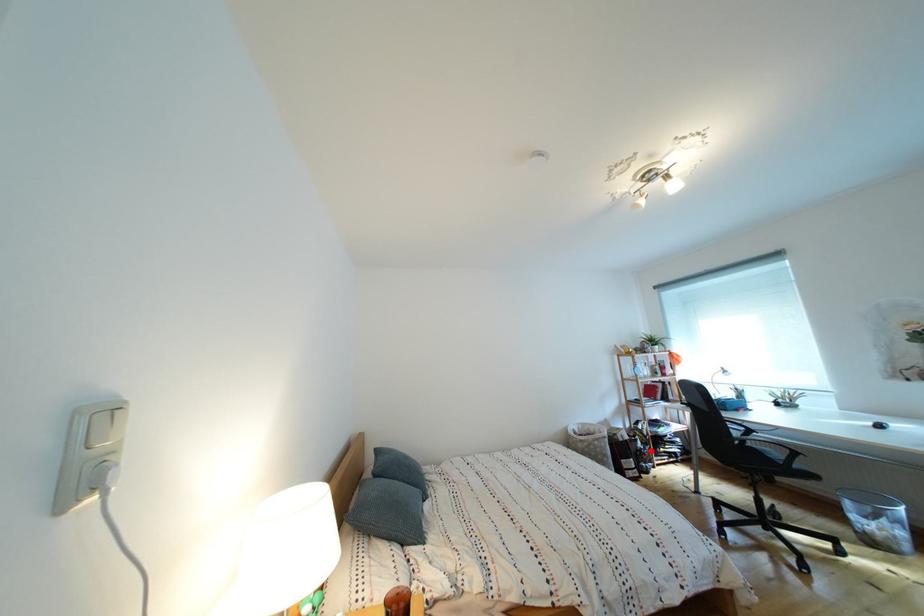
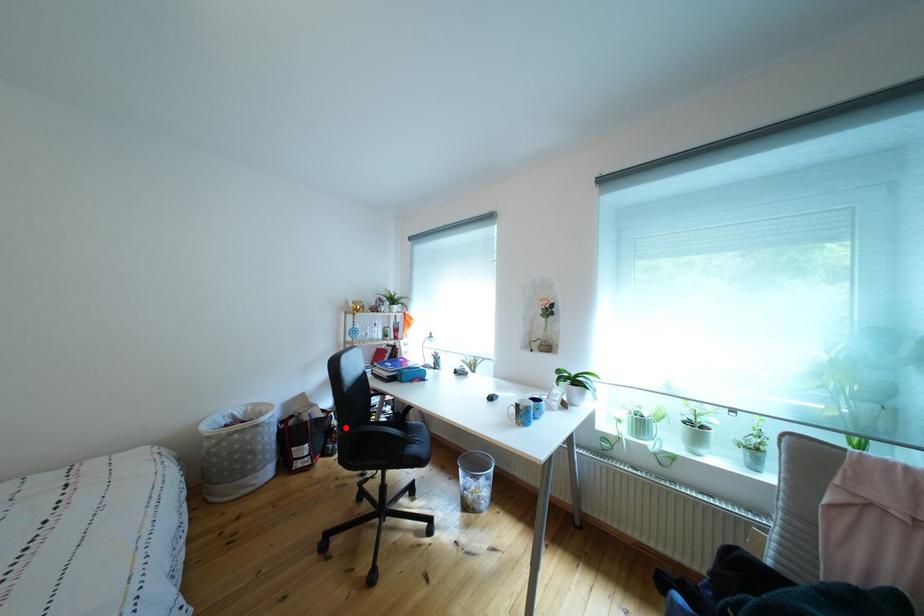
I am providing you with two images of the same scene from different viewpoints. A red point is marked on the first image and another point is marked on the second image. Is the marked point in image1 the same physical position as the marked point in image2?

Yes